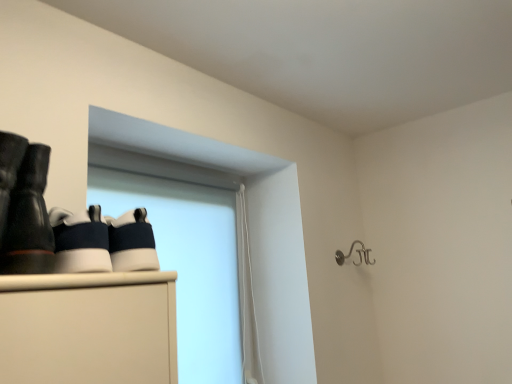
Question: Is silver metallic hook at upper right surrounding white matte window screen at upper left?

Choices:
 (A) yes
 (B) no

Answer: (B)

Question: Does silver metallic hook at upper right have a greater width compared to white matte window screen at upper left?

Choices:
 (A) yes
 (B) no

Answer: (A)

Question: Is silver metallic hook at upper right not within white matte window screen at upper left?

Choices:
 (A) no
 (B) yes

Answer: (B)

Question: From the image's perspective, is silver metallic hook at upper right beneath white matte window screen at upper left?

Choices:
 (A) no
 (B) yes

Answer: (A)

Question: Is silver metallic hook at upper right next to white matte window screen at upper left?

Choices:
 (A) no
 (B) yes

Answer: (A)

Question: From their relative heights in the image, would you say white matte window screen at upper left is taller or shorter than matte black boots at left?

Choices:
 (A) short
 (B) tall

Answer: (B)

Question: In terms of size, does white matte window screen at upper left appear bigger or smaller than matte black boots at left?

Choices:
 (A) small
 (B) big

Answer: (B)

Question: Looking at their shapes, would you say white matte window screen at upper left is wider or thinner than matte black boots at left?

Choices:
 (A) wide
 (B) thin

Answer: (B)

Question: From a real-world perspective, is white matte window screen at upper left positioned above or below matte black boots at left?

Choices:
 (A) above
 (B) below

Answer: (B)

Question: Is matte black boots at left taller or shorter than white matte window screen at upper left?

Choices:
 (A) tall
 (B) short

Answer: (B)

Question: Considering their positions, is matte black boots at left located in front of or behind white matte window screen at upper left?

Choices:
 (A) front
 (B) behind

Answer: (A)

Question: Based on their sizes in the image, would you say matte black boots at left is bigger or smaller than white matte window screen at upper left?

Choices:
 (A) small
 (B) big

Answer: (A)

Question: Do you think matte black boots at left is within white matte window screen at upper left, or outside of it?

Choices:
 (A) inside
 (B) outside

Answer: (B)

Question: Is matte black boots at left taller or shorter than silver metallic hook at upper right?

Choices:
 (A) tall
 (B) short

Answer: (A)

Question: Is matte black boots at left inside or outside of silver metallic hook at upper right?

Choices:
 (A) outside
 (B) inside

Answer: (A)